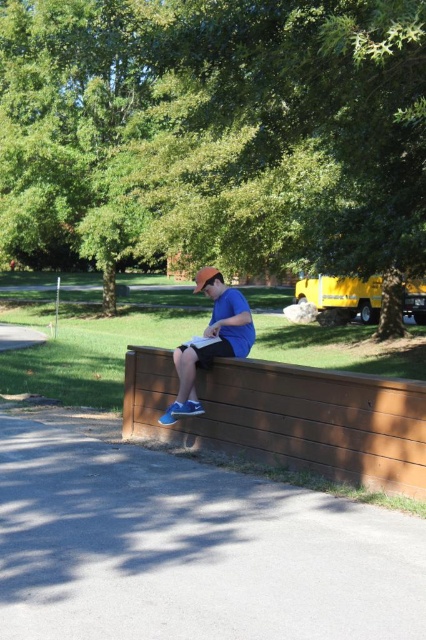
You are standing on the paved pathway in the park scene. You notice the green leafy tree at upper center and the matte blue shorts at center. Which object is larger in size?

The green leafy tree at upper center is bigger than the matte blue shorts at center.

You are standing on the paved pathway in the park and see the brown wooden bench at center and the matte blue shorts at center. Which object is positioned lower in the image?

The brown wooden bench at center is positioned lower than the matte blue shorts at center.